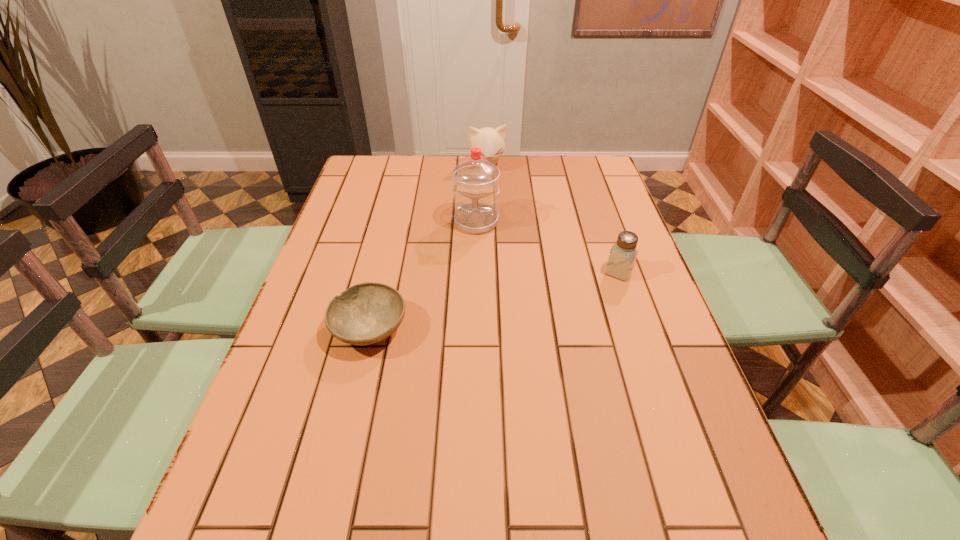
Where is `vacant space on the desktop that is between the shortest object and the third farthest object and is positioned on the face of the kitten`? This screenshot has width=960, height=540. vacant space on the desktop that is between the shortest object and the third farthest object and is positioned on the face of the kitten is located at coordinates (525, 293).

You are a GUI agent. You are given a task and a screenshot of the screen. Output one action in this format:
    pyautogui.click(x=<x>, y=<y>)
    Task: Click on the free space on the desktop that is between the nearest object and the saltshaker and is positioned on the handle side of the water bottle
    The height and width of the screenshot is (540, 960).
    Given the screenshot: What is the action you would take?
    pyautogui.click(x=468, y=306)